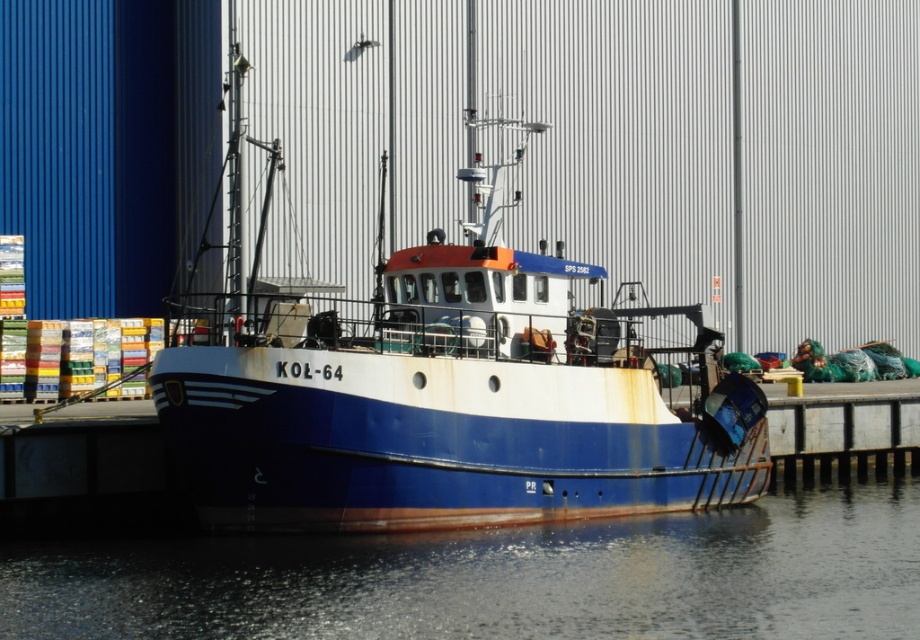
You are standing on the pier and looking at the blue matte boat at center and the glossy water at lower center. Which object is taller from your viewpoint?

The blue matte boat at center is taller than the glossy water at lower center.